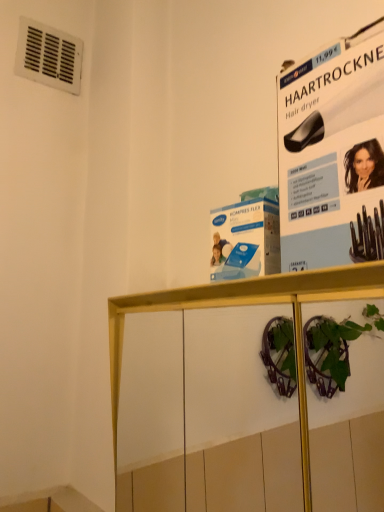
Question: Is white plastic vent at upper left not within white paper at upper right?

Choices:
 (A) no
 (B) yes

Answer: (B)

Question: From the image's perspective, would you say white plastic vent at upper left is positioned over white paper at upper right?

Choices:
 (A) no
 (B) yes

Answer: (B)

Question: Is white plastic vent at upper left to the right of white paper at upper right from the viewer's perspective?

Choices:
 (A) yes
 (B) no

Answer: (B)

Question: Is white plastic vent at upper left oriented towards white paper at upper right?

Choices:
 (A) no
 (B) yes

Answer: (A)

Question: Can you confirm if white plastic vent at upper left is smaller than white paper at upper right?

Choices:
 (A) no
 (B) yes

Answer: (B)

Question: Considering the positions of white paper at upper right and white plastic vent at upper left in the image, is white paper at upper right bigger or smaller than white plastic vent at upper left?

Choices:
 (A) small
 (B) big

Answer: (B)

Question: From their relative heights in the image, would you say white paper at upper right is taller or shorter than white plastic vent at upper left?

Choices:
 (A) tall
 (B) short

Answer: (A)

Question: Considering their positions, is white paper at upper right located in front of or behind white plastic vent at upper left?

Choices:
 (A) front
 (B) behind

Answer: (A)

Question: From a real-world perspective, is white paper at upper right above or below white plastic vent at upper left?

Choices:
 (A) below
 (B) above

Answer: (A)

Question: From the image's perspective, is white plastic vent at upper left located above or below white paper at upper right?

Choices:
 (A) below
 (B) above

Answer: (B)

Question: Considering the positions of white plastic vent at upper left and white paper at upper right in the image, is white plastic vent at upper left taller or shorter than white paper at upper right?

Choices:
 (A) tall
 (B) short

Answer: (B)

Question: Is white plastic vent at upper left bigger or smaller than white paper at upper right?

Choices:
 (A) big
 (B) small

Answer: (B)

Question: From a real-world perspective, is white plastic vent at upper left physically located above or below white paper at upper right?

Choices:
 (A) above
 (B) below

Answer: (A)

Question: In the image, is white paper at upper right on the left side or the right side of wooden shelf at center?

Choices:
 (A) left
 (B) right

Answer: (B)

Question: In terms of size, does white paper at upper right appear bigger or smaller than wooden shelf at center?

Choices:
 (A) small
 (B) big

Answer: (A)